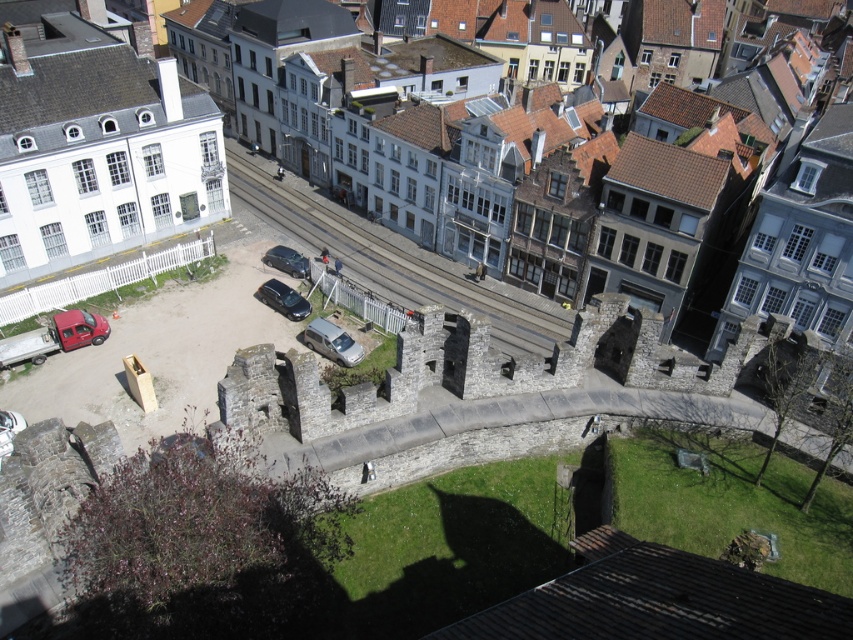
Question: Is silver metallic van at center to the left of shiny black car at center from the viewer's perspective?

Choices:
 (A) yes
 (B) no

Answer: (B)

Question: Which point is farther from the camera taking this photo?

Choices:
 (A) (62, 337)
 (B) (288, 300)
 (C) (370, 252)
 (D) (282, 250)

Answer: (C)

Question: Among these points, which one is farthest from the camera?

Choices:
 (A) (432, 275)
 (B) (68, 330)
 (C) (67, 147)
 (D) (312, 333)

Answer: (A)

Question: Does stone wall at center have a larger size compared to silver metallic van at center?

Choices:
 (A) no
 (B) yes

Answer: (B)

Question: Does stone wall at center appear over silver metallic van at center?

Choices:
 (A) no
 (B) yes

Answer: (B)

Question: Which point is farther from the camera taking this photo?

Choices:
 (A) (840, 120)
 (B) (351, 352)
 (C) (405, 260)
 (D) (306, 262)

Answer: (C)